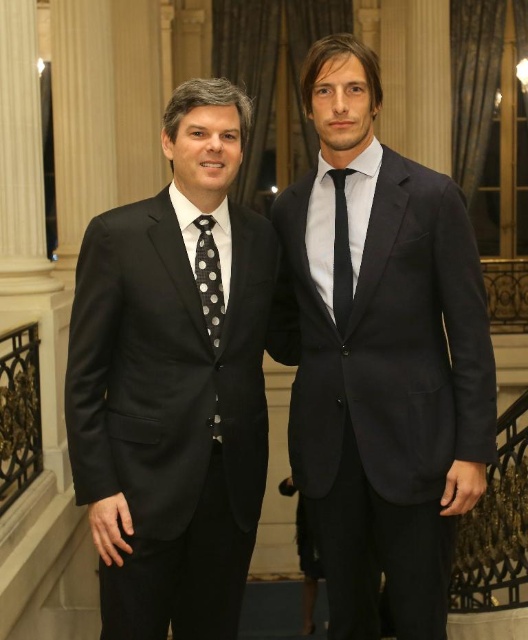
You are a photographer setting up for a group photo. You need to ensure that all subjects are visible in the frame. Given that the matte black suit at left and the black dotted fabric tie at left are both in the shot, which one is wider and might require more space in the frame?

The matte black suit at left is wider than the black dotted fabric tie at left, so it requires more space in the frame.